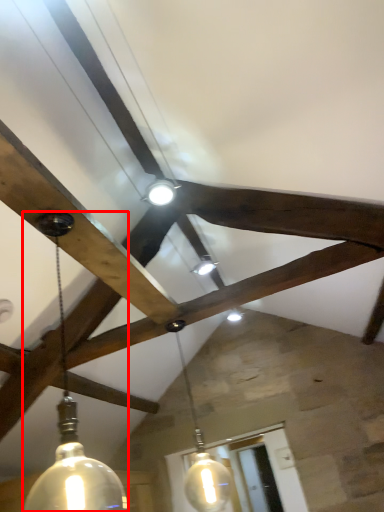
Question: Considering the relative positions of lamp (annotated by the red box) and lamp in the image provided, where is lamp (annotated by the red box) located with respect to the staircase?

Choices:
 (A) right
 (B) left

Answer: (B)